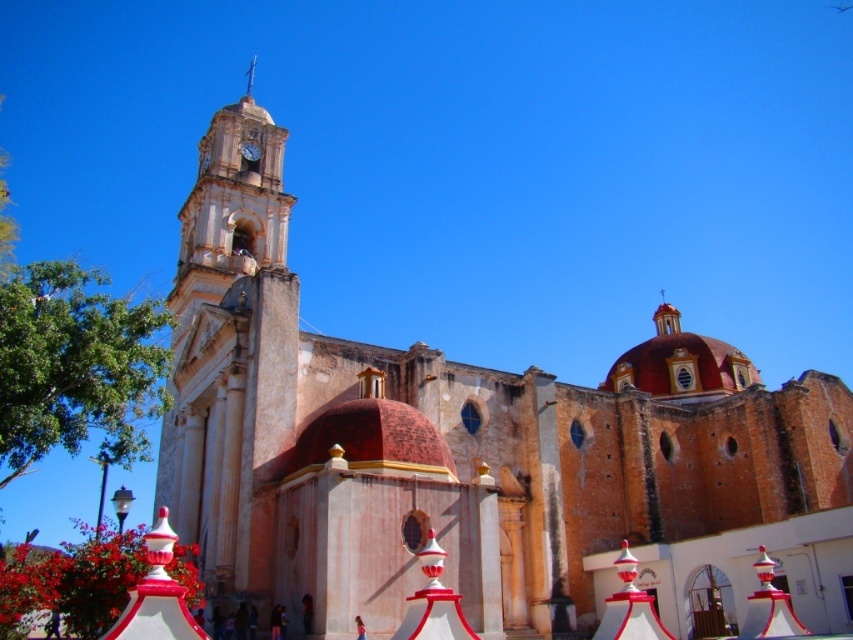
Does stone clock tower at left appear under metallic clock at upper center?

Yes.

Between stone clock tower at left and metallic clock at upper center, which one has more height?

Standing taller between the two is stone clock tower at left.

Between point (184, 227) and point (256, 145), which one is positioned in front?

Positioned in front is point (184, 227).

You are a GUI agent. You are given a task and a screenshot of the screen. Output one action in this format:
    pyautogui.click(x=<x>, y=<y>)
    Task: Click on the stone clock tower at left
    This screenshot has height=640, width=853.
    Given the screenshot: What is the action you would take?
    pyautogui.click(x=230, y=353)

Who is lower down, metallic clock at upper center or smooth silver spire at upper center?

Positioned lower is metallic clock at upper center.

Does metallic clock at upper center have a lesser width compared to smooth silver spire at upper center?

Indeed, metallic clock at upper center has a lesser width compared to smooth silver spire at upper center.

The height and width of the screenshot is (640, 853). What are the coordinates of `metallic clock at upper center` in the screenshot? It's located at (250, 150).

Find the location of a particular element. The height and width of the screenshot is (640, 853). metallic clock at upper center is located at coordinates (250, 150).

Can you confirm if stone clock tower at left is positioned to the left of smooth silver spire at upper center?

No, stone clock tower at left is not to the left of smooth silver spire at upper center.

Where is `stone clock tower at left`? The width and height of the screenshot is (853, 640). stone clock tower at left is located at coordinates (230, 353).

Is point (213, 184) more distant than point (250, 70)?

No, it is in front of (250, 70).

Find the location of a particular element. stone clock tower at left is located at coordinates (230, 353).